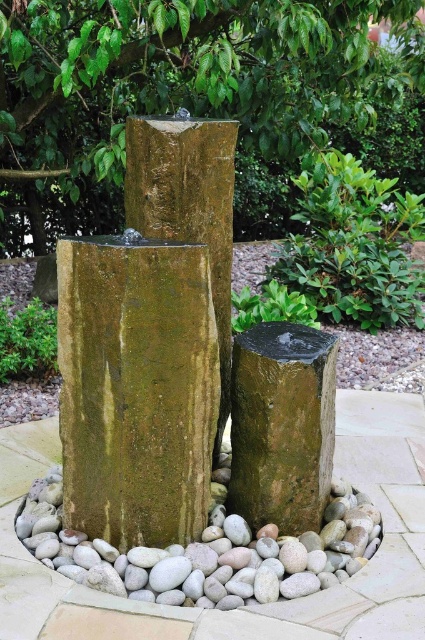
Question: Does green mossy rock at center lie behind green mossy stone at center?

Choices:
 (A) yes
 (B) no

Answer: (A)

Question: Is green mossy stump at center wider than green mossy rock at lower left?

Choices:
 (A) yes
 (B) no

Answer: (A)

Question: Which is nearer to the green mossy rock at lower left?

Choices:
 (A) green mossy rock at center
 (B) smooth gray stones at center
 (C) green mossy stone at center

Answer: (A)

Question: Considering the relative positions of green mossy rock at center and green mossy stump at center in the image provided, where is green mossy rock at center located with respect to green mossy stump at center?

Choices:
 (A) below
 (B) above

Answer: (B)

Question: Which of the following is the closest to the observer?

Choices:
 (A) (78, 332)
 (B) (36, 301)
 (C) (316, 518)
 (D) (285, 230)

Answer: (A)

Question: Which object is the farthest from the green mossy stump at center?

Choices:
 (A) green mossy stone at center
 (B) green mossy rock at center
 (C) smooth gray stones at center

Answer: (B)